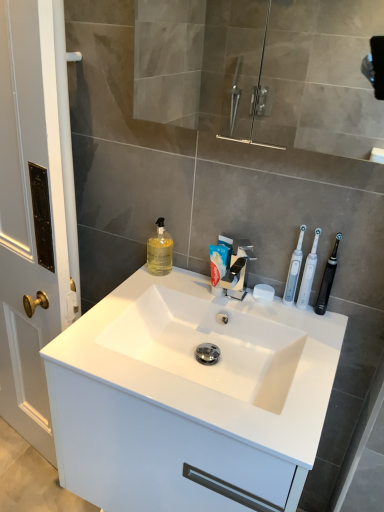
I want to click on free space in front of black plastic toothbrush at right, which is the third toothbrush from left to right, so click(x=319, y=344).